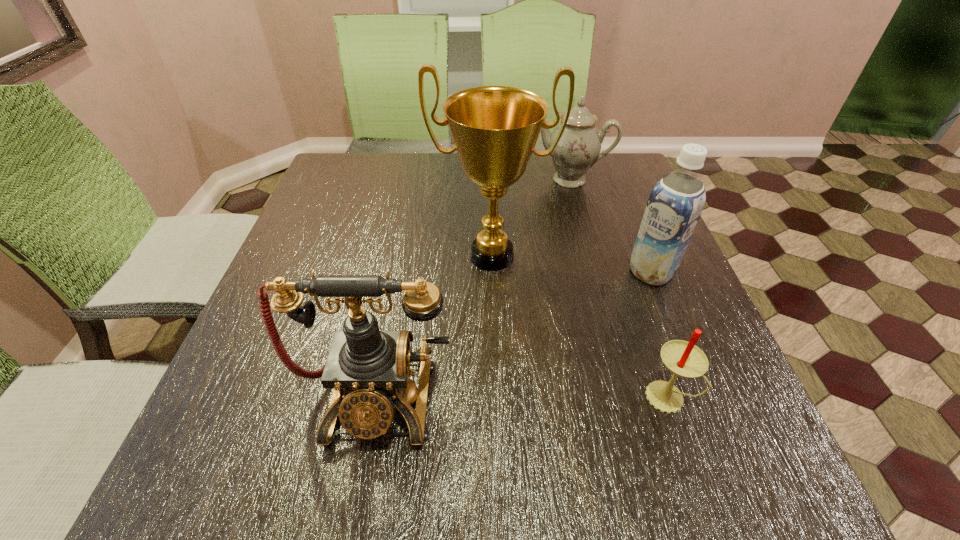
The image size is (960, 540). I want to click on telephone, so point(368,368).

You are a GUI agent. You are given a task and a screenshot of the screen. Output one action in this format:
    pyautogui.click(x=<x>, y=<y>)
    Task: Click on the shortest object
    The height and width of the screenshot is (540, 960).
    Given the screenshot: What is the action you would take?
    pyautogui.click(x=684, y=359)

The width and height of the screenshot is (960, 540). In order to click on chinaware in this screenshot , I will do `click(578, 149)`.

The image size is (960, 540). Find the location of `the second shortest object`. the second shortest object is located at coordinates [578, 149].

You are a GUI agent. You are given a task and a screenshot of the screen. Output one action in this format:
    pyautogui.click(x=<x>, y=<y>)
    Task: Click on the award
    
    Given the screenshot: What is the action you would take?
    pyautogui.click(x=494, y=128)

Find the location of a particular element. soya milk is located at coordinates (676, 202).

Locate an element on the screen. free space located 0.110m on the left of the shortest object is located at coordinates (580, 396).

At what (x,y) coordinates should I click in order to perform the action: click on vacant area situated on the spout of the farthest object. Please return your answer as a coordinate pair (x, y). This screenshot has width=960, height=540. Looking at the image, I should click on (550, 255).

Identify the location of vacant space located 0.200m on the spout of the farthest object. The height and width of the screenshot is (540, 960). (554, 237).

What are the coordinates of `free space located on the spout of the farthest object` in the screenshot? It's located at (553, 242).